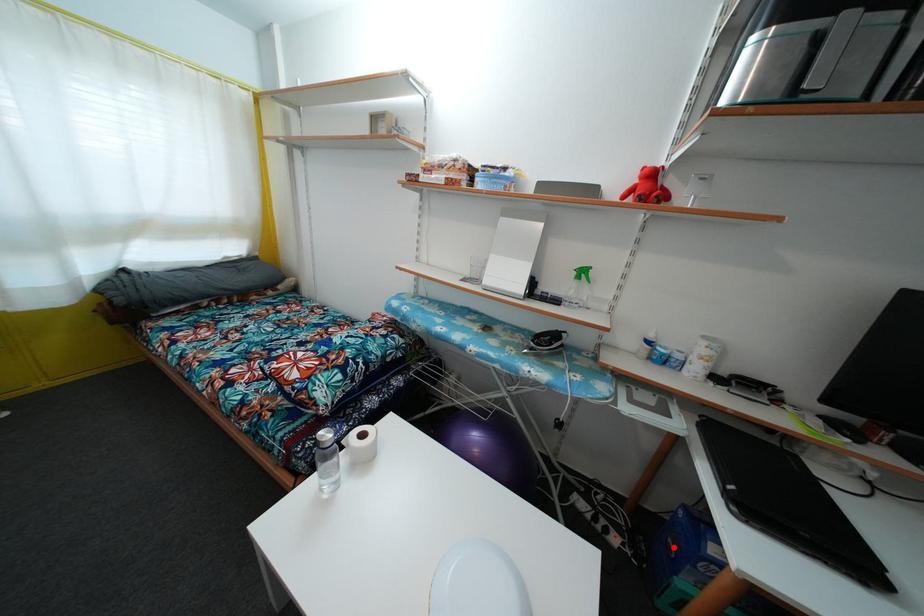
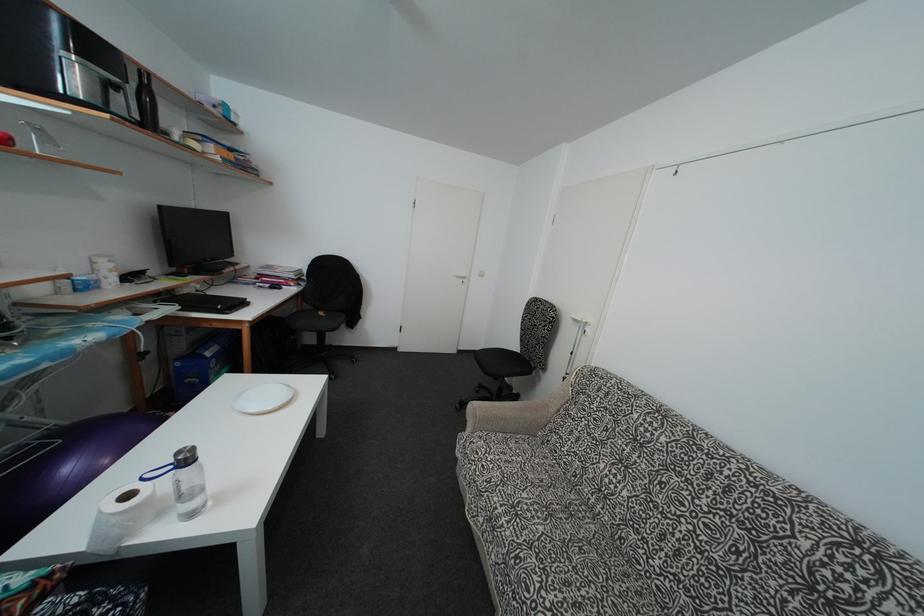
Find the pixel in the second image that matches the highlighted location in the first image.

(190, 387)